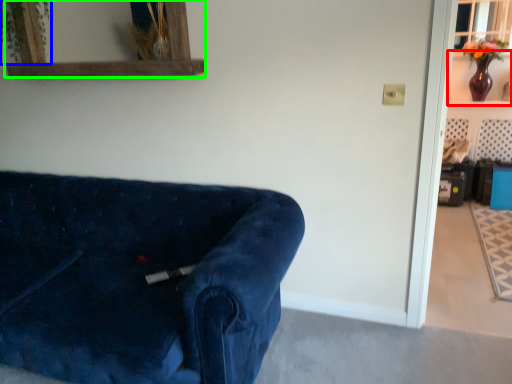
Question: Which object is the farthest from shelf (highlighted by a red box)? Choose among these: plant (highlighted by a blue box) or mirror (highlighted by a green box).

Choices:
 (A) plant
 (B) mirror

Answer: (A)